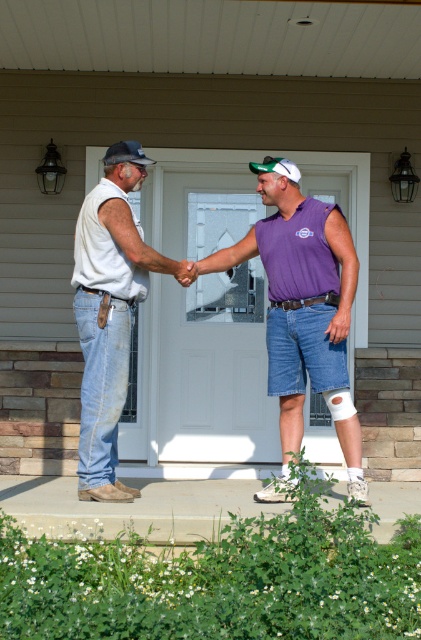
You are a delivery person who needs to place a small package between the purple fabric sleeveless shirt at center and the white matte bandage at lower center. Can you fit the package if it measures 20 inches in length?

The distance between the purple fabric sleeveless shirt at center and the white matte bandage at lower center is 22.71 inches. Since the package is 20 inches long, it can fit within the space provided.

You are a fashion designer observing the two men on the porch. You need to determine which item of clothing is larger in size between the purple fabric sleeveless shirt at center and the white matte bandage at lower center. Which one is bigger?

The purple fabric sleeveless shirt at center is bigger than the white matte bandage at lower center.

You are a photographer trying to capture the two men shaking hands on the porch. You notice the purple fabric sleeveless shirt at center and the denim jeans at left. Which clothing item is located to the right of the other?

The purple fabric sleeveless shirt at center is positioned on the right side of denim jeans at left, so the purple sleeveless shirt is to the right of the denim jeans.